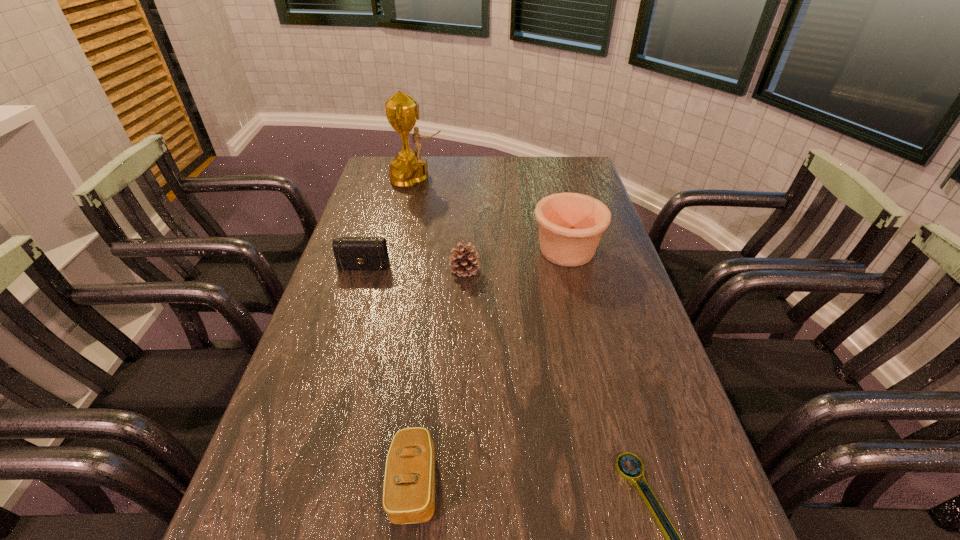
The height and width of the screenshot is (540, 960). Identify the location of object that is the fourth closest to the nearer clutch bag. (x=570, y=224).

Locate an element on the screen. free space that satisfies the following two spatial constraints: 1. on the front side of the pottery; 2. on the zipper side of the nearer clutch bag is located at coordinates tap(623, 483).

Where is `free space that satisfies the following two spatial constraints: 1. on the front side of the fifth shortest object; 2. on the right side of the award`? This screenshot has height=540, width=960. free space that satisfies the following two spatial constraints: 1. on the front side of the fifth shortest object; 2. on the right side of the award is located at coordinates (401, 251).